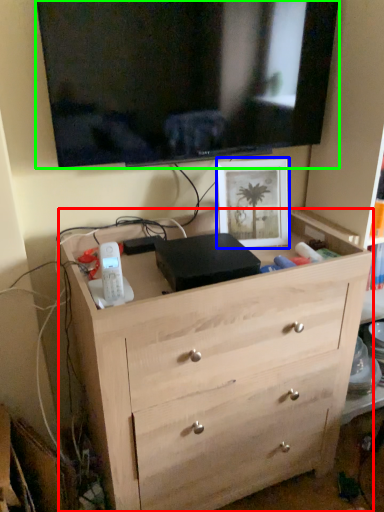
Question: Estimate the real-world distances between objects in this image. Which object is farther from chest of drawers (highlighted by a red box), picture frame (highlighted by a blue box) or television (highlighted by a green box)?

Choices:
 (A) picture frame
 (B) television

Answer: (B)